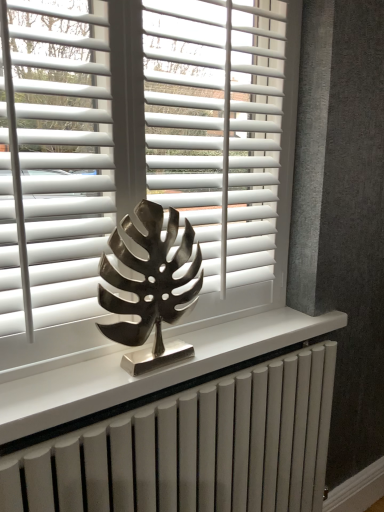
Find the location of a particular element. The height and width of the screenshot is (512, 384). blank space to the left of metallic leaf sculpture at center is located at coordinates [73, 377].